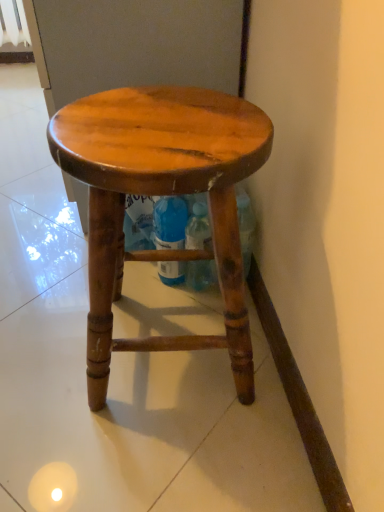
You are a GUI agent. You are given a task and a screenshot of the screen. Output one action in this format:
    pyautogui.click(x=<x>, y=<y>)
    Task: Click on the vacant area situated to the left side of wooden stool at center
    
    Given the screenshot: What is the action you would take?
    pyautogui.click(x=46, y=335)